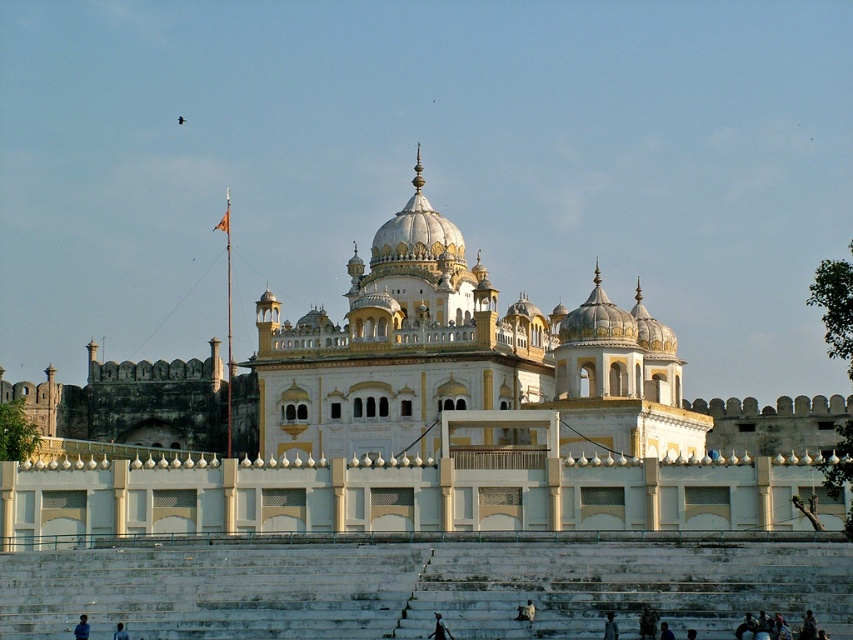
Question: Which of the following is the closest to the observer?

Choices:
 (A) dark blue fabric at lower left
 (B) dark blue jeans at lower left
 (C) white stone stairs at center

Answer: (C)

Question: Is black fabric person at lower center to the left of dark blue fabric at lower left from the viewer's perspective?

Choices:
 (A) no
 (B) yes

Answer: (A)

Question: Where is white stone stairs at center located in relation to dark blue fabric at lower left in the image?

Choices:
 (A) below
 (B) above

Answer: (B)

Question: Which of these objects is positioned closest to the white stone stairs at center?

Choices:
 (A) white marble palace at center
 (B) dark blue fabric at lower center

Answer: (B)

Question: Does black fabric person at lower center have a larger size compared to dark blue fabric at lower left?

Choices:
 (A) yes
 (B) no

Answer: (A)

Question: Which point is farther to the camera?

Choices:
 (A) dark blue fabric at lower center
 (B) white marble palace at center
 (C) dark blue fabric at lower left
 (D) dark blue jeans at lower left

Answer: (B)